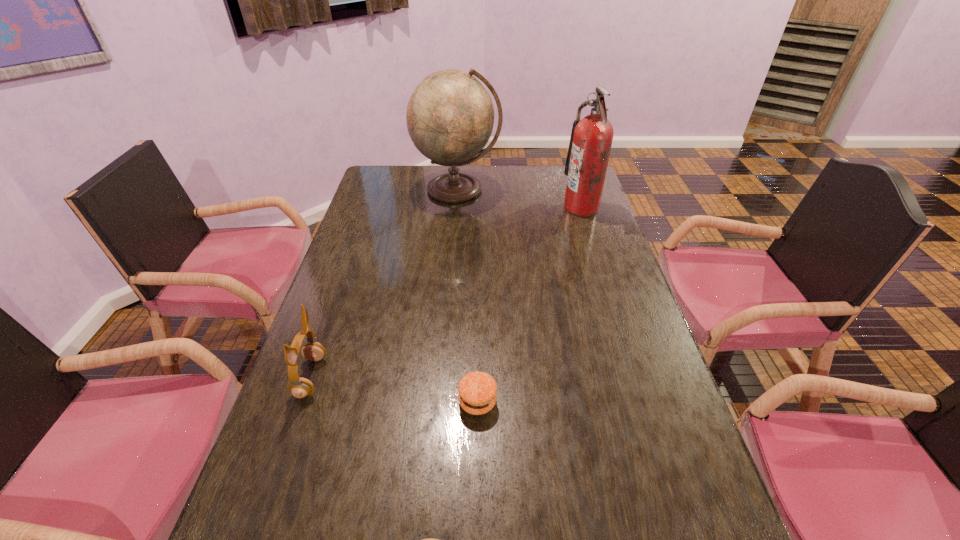
Where is `blank area located on the front-facing side of the leftmost object`? blank area located on the front-facing side of the leftmost object is located at coordinates (468, 377).

This screenshot has height=540, width=960. Find the location of `free space located on the right of the farther patty`. free space located on the right of the farther patty is located at coordinates (565, 402).

At what (x,y) coordinates should I click in order to perform the action: click on globe that is at the far edge. Please return your answer as a coordinate pair (x, y). The height and width of the screenshot is (540, 960). Looking at the image, I should click on (450, 115).

This screenshot has height=540, width=960. I want to click on fire extinguisher that is at the far edge, so click(x=591, y=139).

This screenshot has height=540, width=960. I want to click on object that is at the left edge, so click(x=300, y=387).

The image size is (960, 540). In order to click on object that is positioned at the right edge in this screenshot , I will do `click(591, 139)`.

This screenshot has width=960, height=540. I want to click on object at the far right corner, so click(591, 139).

The height and width of the screenshot is (540, 960). Find the location of `free space at the far edge of the desktop`. free space at the far edge of the desktop is located at coordinates (425, 173).

You are a GUI agent. You are given a task and a screenshot of the screen. Output one action in this format:
    pyautogui.click(x=<x>, y=<y>)
    Task: Click on the vacant space at the left edge
    This screenshot has width=960, height=540.
    Given the screenshot: What is the action you would take?
    pyautogui.click(x=305, y=458)

Where is `free region at the right edge`? free region at the right edge is located at coordinates (624, 265).